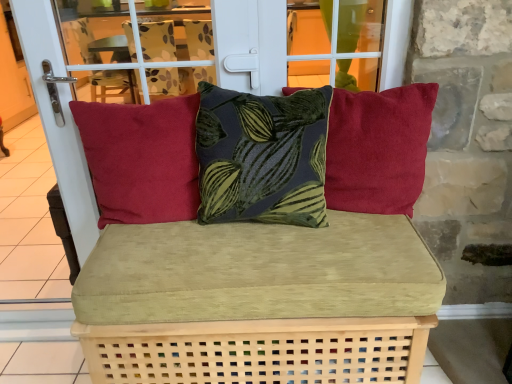
Question: Considering the relative sizes of matte red cushion at left, positioned as the 1th pillow in left-to-right order, and velvet green leaf-patterned pillow at center, the 2th pillow in the left-to-right sequence, in the image provided, is matte red cushion at left, positioned as the 1th pillow in left-to-right order, thinner than velvet green leaf-patterned pillow at center, the 2th pillow in the left-to-right sequence,?

Choices:
 (A) no
 (B) yes

Answer: (B)

Question: Can velvet green leaf-patterned pillow at center, the 2th pillow in the left-to-right sequence, be found inside matte red cushion at left, acting as the third pillow starting from the right?

Choices:
 (A) no
 (B) yes

Answer: (A)

Question: From a real-world perspective, is matte red cushion at left, acting as the third pillow starting from the right, positioned over velvet green leaf-patterned pillow at center, the second pillow in the right-to-left sequence, based on gravity?

Choices:
 (A) no
 (B) yes

Answer: (A)

Question: From the image's perspective, would you say matte red cushion at left, positioned as the 1th pillow in left-to-right order, is positioned over velvet green leaf-patterned pillow at center, the second pillow in the right-to-left sequence?

Choices:
 (A) no
 (B) yes

Answer: (A)

Question: Is matte red cushion at left, positioned as the 1th pillow in left-to-right order, at the right side of velvet green leaf-patterned pillow at center, the second pillow in the right-to-left sequence?

Choices:
 (A) yes
 (B) no

Answer: (B)

Question: Can you confirm if matte red cushion at left, acting as the third pillow starting from the right, is taller than velvet green leaf-patterned pillow at center, the second pillow in the right-to-left sequence?

Choices:
 (A) yes
 (B) no

Answer: (A)

Question: Is matte red cushion at left, positioned as the 1th pillow in left-to-right order, facing towards velvet green cushion at center?

Choices:
 (A) no
 (B) yes

Answer: (A)

Question: Is matte red cushion at left, acting as the third pillow starting from the right, looking in the opposite direction of velvet green cushion at center?

Choices:
 (A) no
 (B) yes

Answer: (A)

Question: Is matte red cushion at left, positioned as the 1th pillow in left-to-right order, smaller than velvet green cushion at center?

Choices:
 (A) yes
 (B) no

Answer: (A)

Question: Can you confirm if matte red cushion at left, positioned as the 1th pillow in left-to-right order, is positioned to the left of velvet green cushion at center?

Choices:
 (A) yes
 (B) no

Answer: (A)

Question: From a real-world perspective, is matte red cushion at left, acting as the third pillow starting from the right, on top of velvet green cushion at center?

Choices:
 (A) yes
 (B) no

Answer: (A)

Question: Does matte red cushion at left, acting as the third pillow starting from the right, contain velvet green cushion at center?

Choices:
 (A) no
 (B) yes

Answer: (A)

Question: Is velvet green leaf-patterned pillow at center, the second pillow in the right-to-left sequence, smaller than matte red cushion at right, the first pillow in the right-to-left sequence?

Choices:
 (A) no
 (B) yes

Answer: (A)